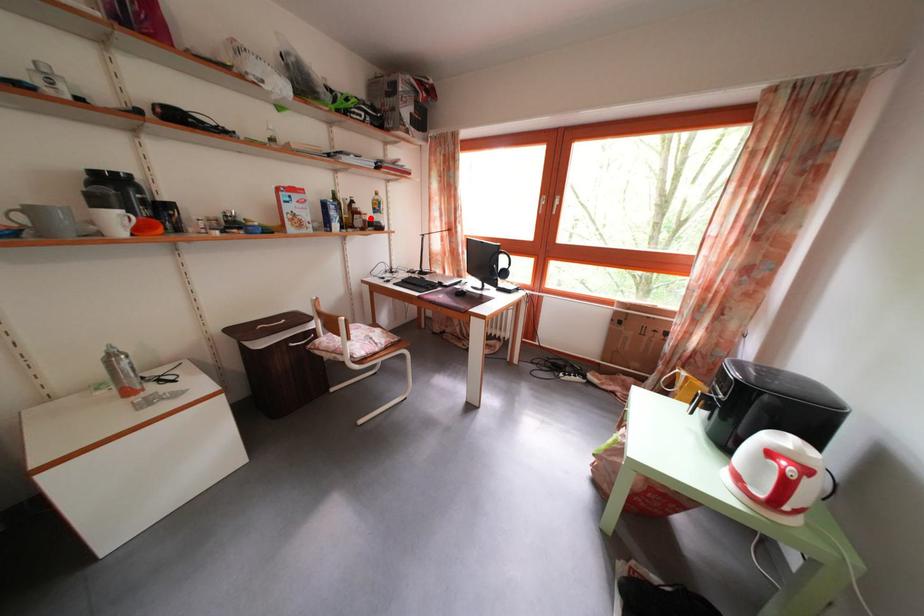
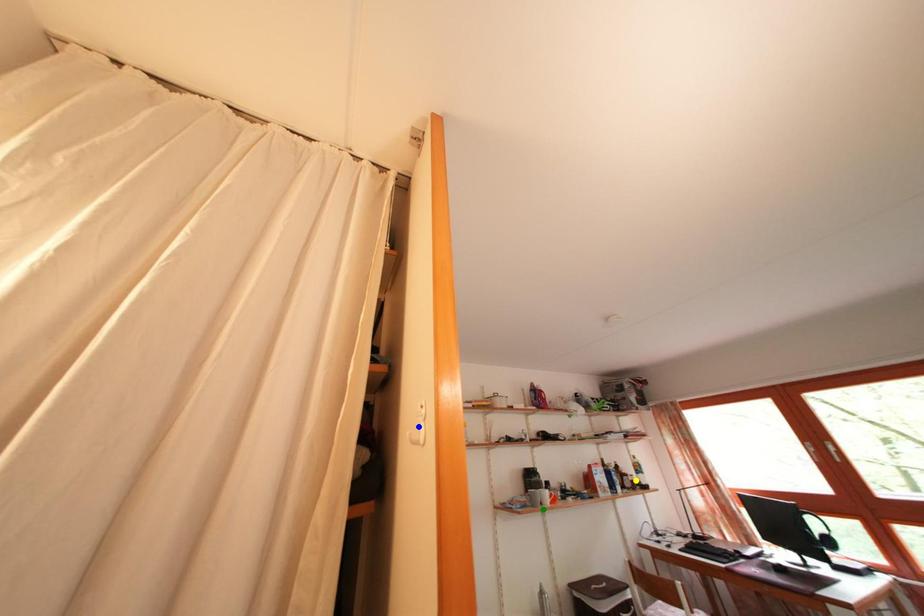
Question: I am providing you with two images of the same scene from different viewpoints. A red point is marked on the first image. You are given multiple points on the second image. In image 2, which mark is for the same physical point as the one in image 1?

Choices:
 (A) green point
 (B) blue point
 (C) yellow point

Answer: (C)